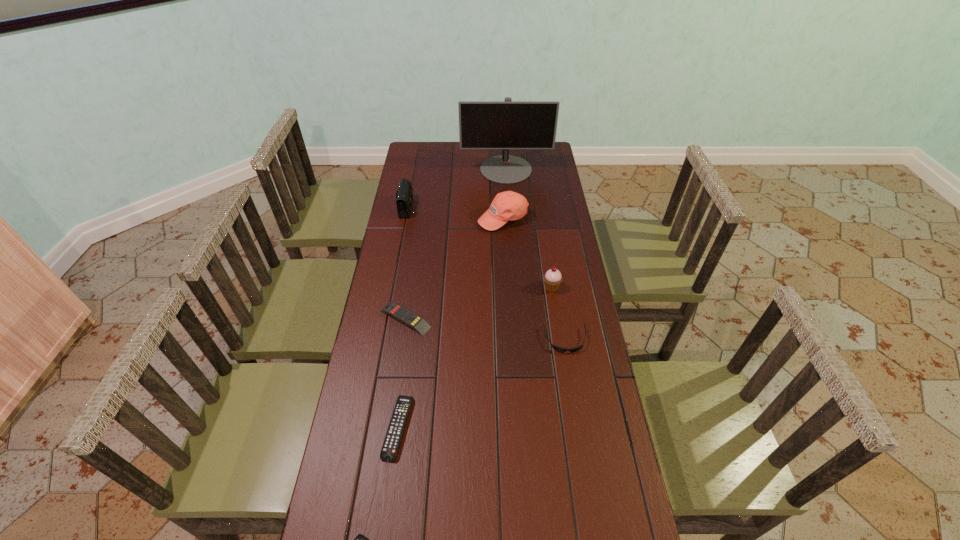
Find the location of a particular element. blank space that satisfies the following two spatial constraints: 1. on the screen of the fifth nearest object; 2. on the left side of the gray computer monitor is located at coordinates (515, 287).